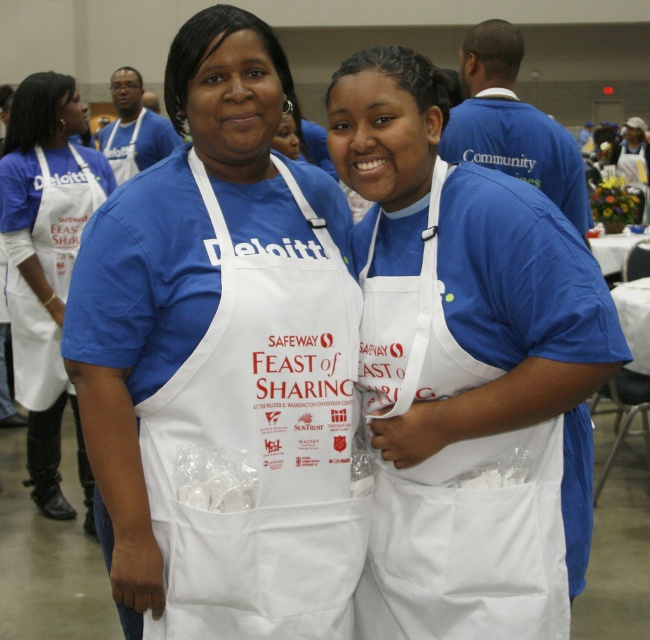
Can you confirm if white matte apron at center is smaller than white paper apron at center?

Yes.

Between white matte apron at center and white paper apron at center, which one appears on the left side from the viewer's perspective?

white paper apron at center is more to the left.

I want to click on white matte apron at center, so click(221, 346).

Is white fabric apron at center bigger than white paper apron at center?

Incorrect, white fabric apron at center is not larger than white paper apron at center.

The image size is (650, 640). Describe the element at coordinates (469, 541) in the screenshot. I see `white fabric apron at center` at that location.

This screenshot has width=650, height=640. Identify the location of white fabric apron at center. (469, 541).

Where is `white fabric apron at center`? This screenshot has height=640, width=650. white fabric apron at center is located at coordinates (469, 541).

Is white matte apron at center thinner than white fabric apron at center?

Incorrect, white matte apron at center's width is not less than white fabric apron at center's.

I want to click on white matte apron at center, so click(x=221, y=346).

The image size is (650, 640). I want to click on white matte apron at center, so click(221, 346).